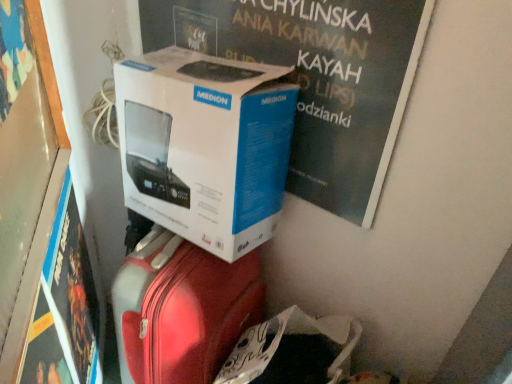
Question: From the image's perspective, is white cardboard box at upper center, the first magazine from the right, located beneath matte black magazine at lower left, which ranks as the first magazine in bottom-to-top order?

Choices:
 (A) no
 (B) yes

Answer: (A)

Question: Considering the relative sizes of white cardboard box at upper center, positioned as the second magazine in bottom-to-top order, and matte black magazine at lower left, which is the second magazine in top-to-bottom order, in the image provided, is white cardboard box at upper center, positioned as the second magazine in bottom-to-top order, bigger than matte black magazine at lower left, which is the second magazine in top-to-bottom order,?

Choices:
 (A) yes
 (B) no

Answer: (A)

Question: Is matte black magazine at lower left, which appears as the second magazine when viewed from the right, surrounded by white cardboard box at upper center, positioned as the second magazine in bottom-to-top order?

Choices:
 (A) yes
 (B) no

Answer: (B)

Question: Considering the relative sizes of white cardboard box at upper center, which is counted as the 2th magazine, starting from the left, and matte black magazine at lower left, which ranks as the first magazine in bottom-to-top order, in the image provided, is white cardboard box at upper center, which is counted as the 2th magazine, starting from the left, thinner than matte black magazine at lower left, which ranks as the first magazine in bottom-to-top order,?

Choices:
 (A) no
 (B) yes

Answer: (A)

Question: From the image's perspective, would you say white cardboard box at upper center, which is counted as the 2th magazine, starting from the left, is positioned over matte black magazine at lower left, which is the second magazine in top-to-bottom order?

Choices:
 (A) no
 (B) yes

Answer: (B)

Question: Is point (128, 107) positioned closer to the camera than point (45, 168)?

Choices:
 (A) farther
 (B) closer

Answer: (A)

Question: From a real-world perspective, is white cardboard box at center physically located above or below wooden frame at left?

Choices:
 (A) below
 (B) above

Answer: (B)

Question: From the image's perspective, is white cardboard box at center above or below wooden frame at left?

Choices:
 (A) above
 (B) below

Answer: (A)

Question: Based on their positions, is white cardboard box at center located to the left or right of wooden frame at left?

Choices:
 (A) right
 (B) left

Answer: (A)

Question: Which is correct: white cardboard box at upper center, arranged as the first magazine when viewed from the top, is inside white cardboard box at center, or outside of it?

Choices:
 (A) inside
 (B) outside

Answer: (B)

Question: Considering the positions of white cardboard box at upper center, arranged as the first magazine when viewed from the top, and white cardboard box at center in the image, is white cardboard box at upper center, arranged as the first magazine when viewed from the top, wider or thinner than white cardboard box at center?

Choices:
 (A) wide
 (B) thin

Answer: (B)

Question: From the image's perspective, relative to white cardboard box at center, is white cardboard box at upper center, arranged as the first magazine when viewed from the top, above or below?

Choices:
 (A) above
 (B) below

Answer: (A)

Question: In terms of height, does white cardboard box at upper center, arranged as the first magazine when viewed from the top, look taller or shorter compared to white cardboard box at center?

Choices:
 (A) tall
 (B) short

Answer: (A)

Question: Considering their positions, is white cardboard box at center located in front of or behind white cardboard box at upper center, the first magazine from the right?

Choices:
 (A) behind
 (B) front

Answer: (A)

Question: Is white cardboard box at center taller or shorter than white cardboard box at upper center, positioned as the second magazine in bottom-to-top order?

Choices:
 (A) tall
 (B) short

Answer: (B)